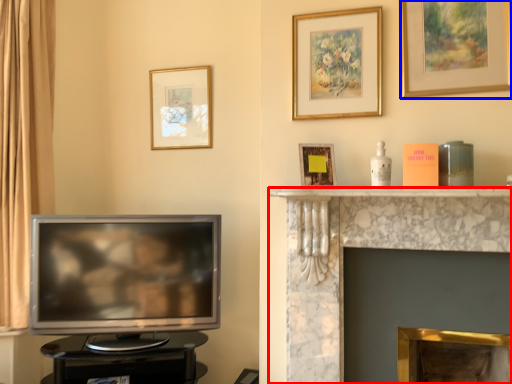
Question: Which point is closer to the camera, fireplace (highlighted by a red box) or picture frame (highlighted by a blue box)?

Choices:
 (A) fireplace
 (B) picture frame

Answer: (A)